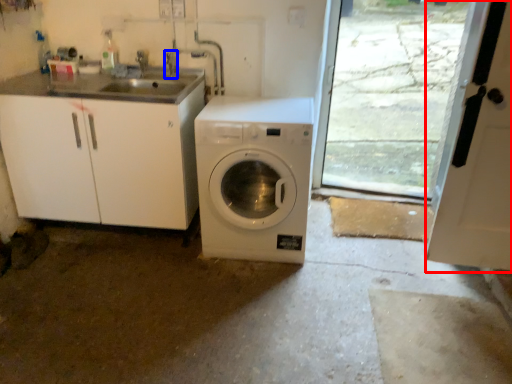
Question: Which point is further to the camera, screen door (highlighted by a red box) or faucet (highlighted by a blue box)?

Choices:
 (A) screen door
 (B) faucet

Answer: (B)